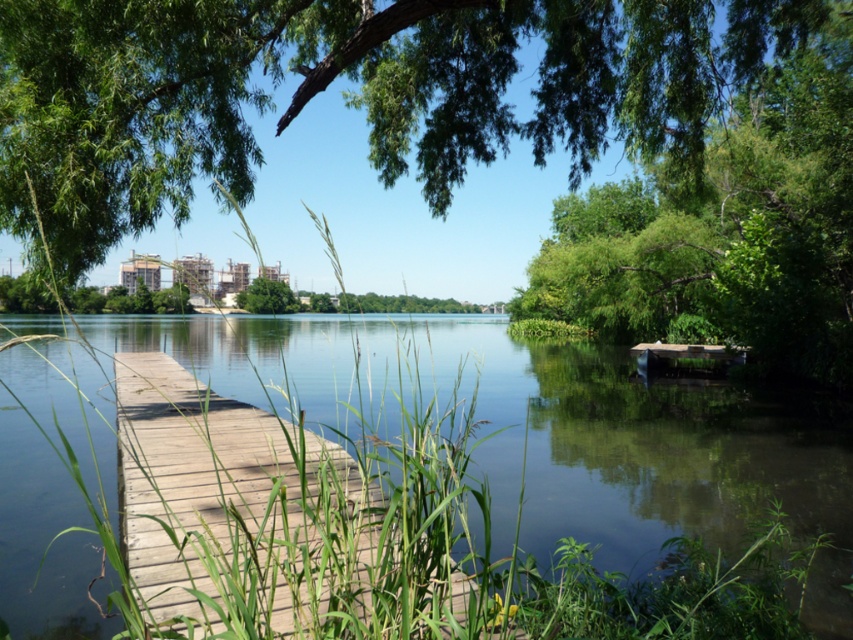
Measure the distance between clear water at dock center and camera.

clear water at dock center and camera are 2.56 meters apart.

Consider the image. Which of these two, clear water at dock center or green leafy tree at right, stands shorter?

clear water at dock center

Who is more forward, (663, 448) or (663, 230)?

Point (663, 448)

The height and width of the screenshot is (640, 853). In order to click on clear water at dock center in this screenshot , I will do `click(631, 451)`.

Looking at this image, does wooden dock at center appear over green leafy tree at center?

Actually, wooden dock at center is below green leafy tree at center.

Measure the distance between wooden dock at center and camera.

wooden dock at center is 1.55 meters from camera.

In order to click on wooden dock at center in this screenshot , I will do `click(286, 518)`.

What are the coordinates of `green leafy tree at upper center` in the screenshot? It's located at (349, 93).

Is point (648, 64) closer to viewer compared to point (270, 292)?

That is True.

Locate an element on the screen. green leafy tree at upper center is located at coordinates (349, 93).

The width and height of the screenshot is (853, 640). Identify the location of green leafy tree at upper center. (349, 93).